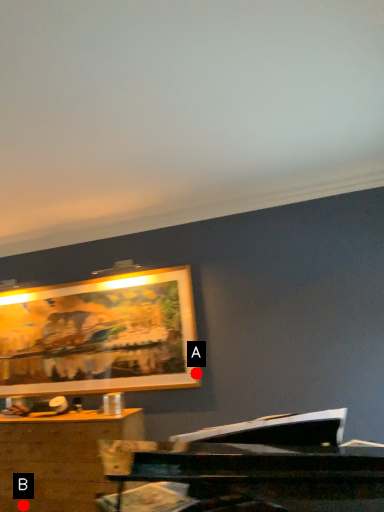
Question: Two points are circled on the image, labeled by A and B beside each circle. Which point is further to the camera?

Choices:
 (A) A is further
 (B) B is further

Answer: (A)